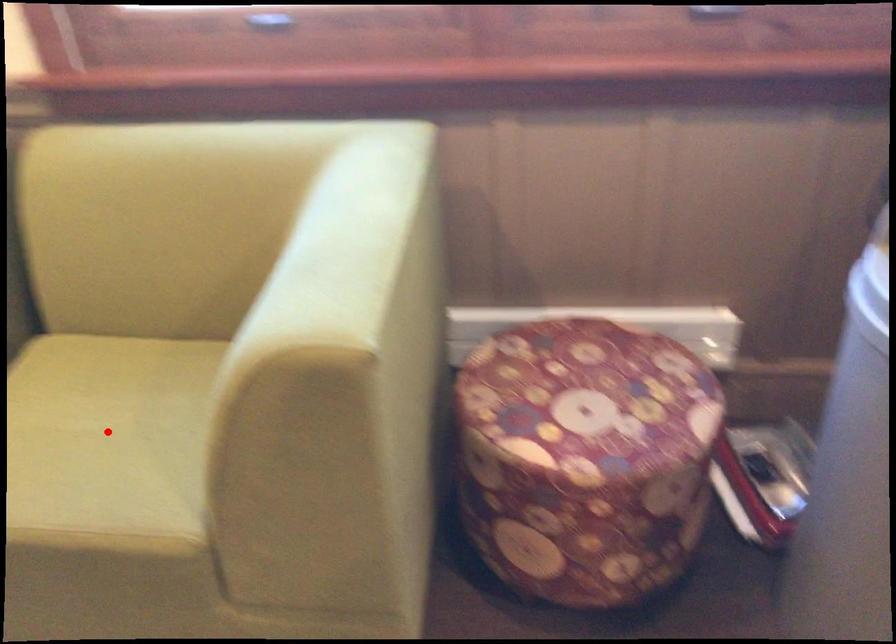
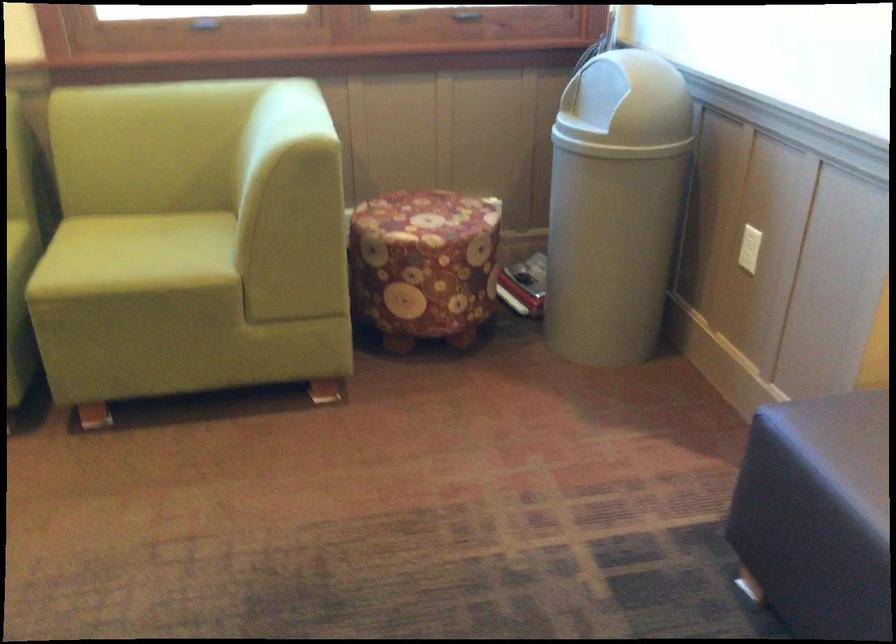
Where in the second image is the point corresponding to the highlighted location from the first image?

(142, 252)